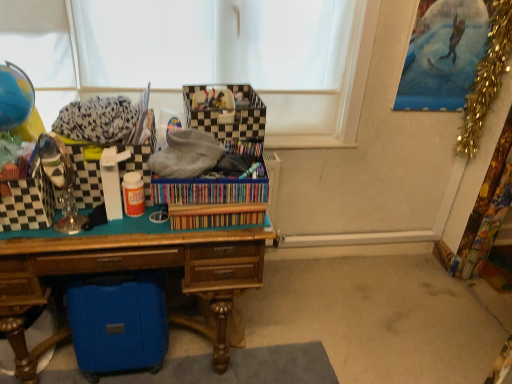
Question: From a real-world perspective, is gold tinsel garland at upper right above or below checkered fabric storage box at center, which appears as the first storage box when viewed from the top?

Choices:
 (A) below
 (B) above

Answer: (B)

Question: From their relative heights in the image, would you say gold tinsel garland at upper right is taller or shorter than checkered fabric storage box at center, acting as the fourth storage box starting from the bottom?

Choices:
 (A) tall
 (B) short

Answer: (A)

Question: Estimate the real-world distances between objects in this image. Which object is farther from the wooden desk at center?

Choices:
 (A) gold tinsel garland at upper right
 (B) blue fabric suitcase at lower left, the first storage box positioned from the bottom
 (C) checkered fabric storage box at center, acting as the fourth storage box starting from the bottom
 (D) checkered plastic storage box at left, which ranks as the second storage box in top-to-bottom order
 (E) checkered plastic storage box at left, which is the 3th storage box from top to bottom

Answer: (A)

Question: Considering the real-world distances, which object is closest to the checkered plastic storage box at left, which is the 3th storage box from top to bottom?

Choices:
 (A) checkered fabric storage box at center, acting as the fourth storage box starting from the bottom
 (B) wooden desk at center
 (C) checkered plastic storage box at left, the third storage box positioned from the bottom
 (D) gold tinsel garland at upper right
 (E) blue fabric suitcase at lower left, the first storage box positioned from the bottom

Answer: (C)